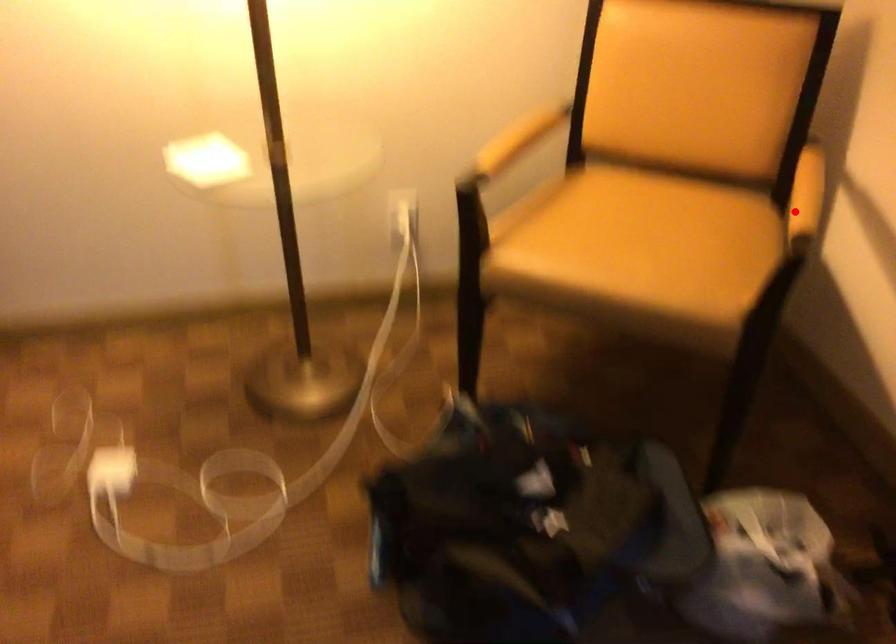
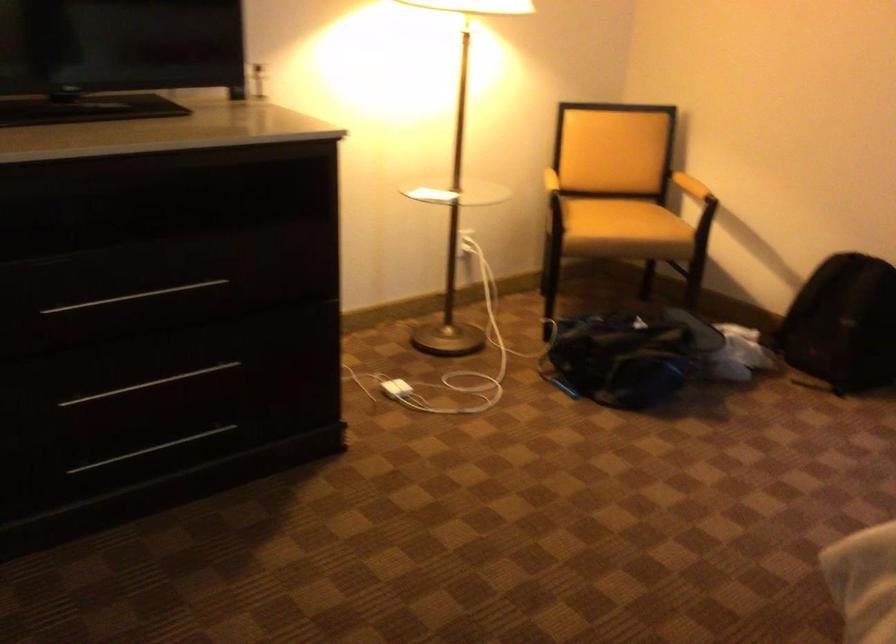
In the second image, find the point that corresponds to the highlighted location in the first image.

(690, 185)